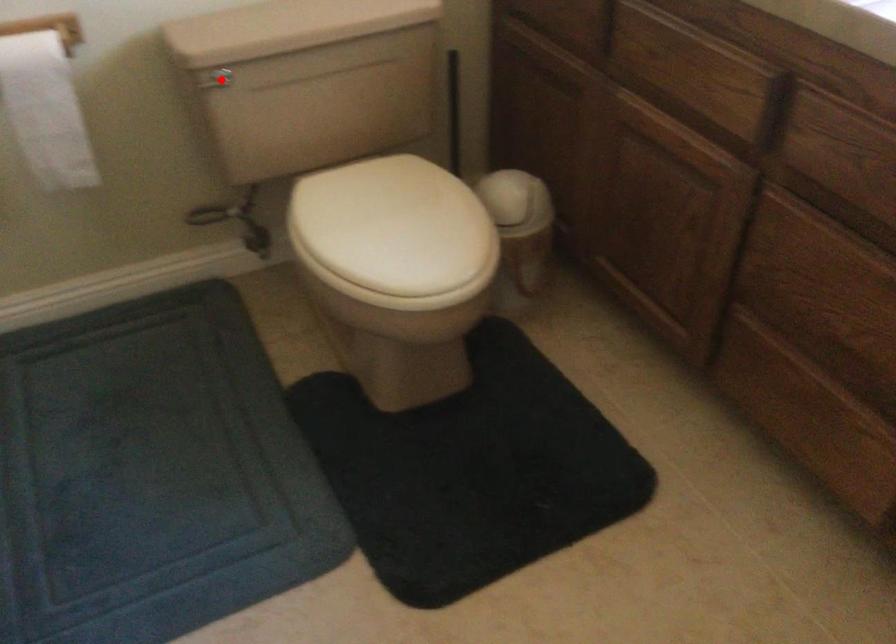
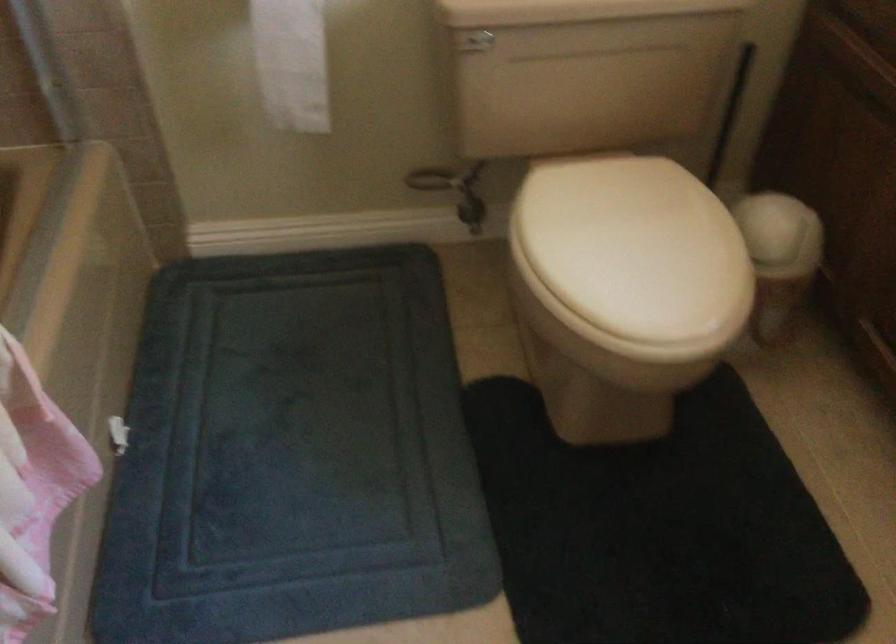
Locate, in the second image, the point that corresponds to the highlighted location in the first image.

(475, 41)